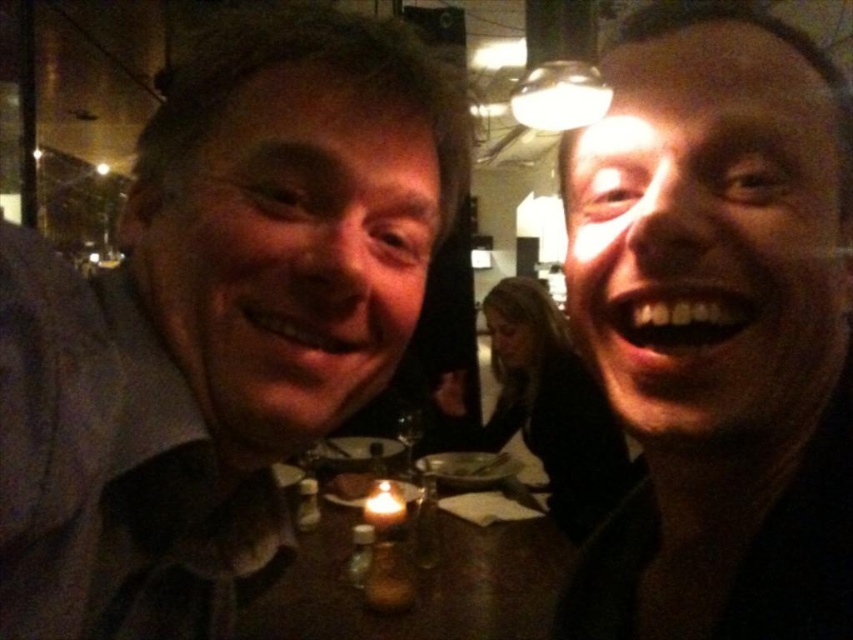
Question: Which point is closer to the camera?

Choices:
 (A) matte black shirt at left
 (B) white wax candle at center

Answer: (A)

Question: Among these objects, which one is nearest to the camera?

Choices:
 (A) wooden table at center
 (B) white wax candle at center
 (C) matte black shirt at left

Answer: (C)

Question: Can you confirm if matte black face at center is positioned to the left of white wax candle at center?

Choices:
 (A) no
 (B) yes

Answer: (A)

Question: Which object is closer to the camera taking this photo?

Choices:
 (A) matte black shirt at left
 (B) wooden table at center
 (C) matte black face at center

Answer: (A)

Question: Does matte black shirt at left have a smaller size compared to matte black face at center?

Choices:
 (A) yes
 (B) no

Answer: (B)

Question: In this image, where is matte black face at center located relative to wooden table at center?

Choices:
 (A) right
 (B) left

Answer: (A)